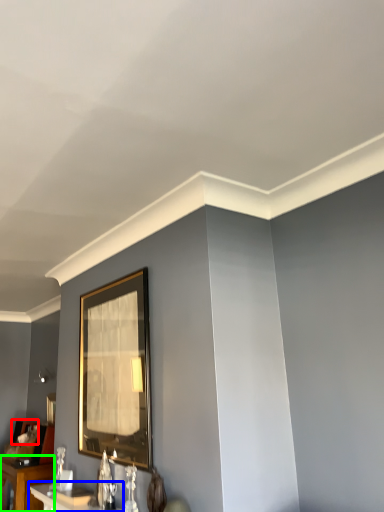
Question: Which object is positioned farthest from picture frame (highlighted by a red box)? Select from table (highlighted by a blue box) and table (highlighted by a green box).

Choices:
 (A) table
 (B) table

Answer: (A)